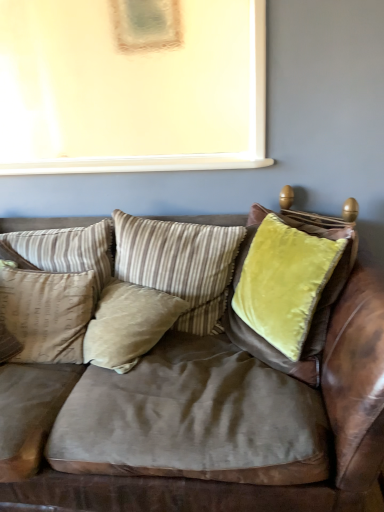
Question: Is beige striped pillow at center, marked as the second pillow in a left-to-right arrangement, taller than beige fabric pillow at left, acting as the 4th pillow starting from the right?

Choices:
 (A) no
 (B) yes

Answer: (A)

Question: Is beige fabric pillow at left, acting as the 4th pillow starting from the right, inside beige striped pillow at center, marked as the second pillow in a left-to-right arrangement?

Choices:
 (A) no
 (B) yes

Answer: (A)

Question: Can you confirm if beige striped pillow at center, marked as the second pillow in a left-to-right arrangement, is shorter than beige fabric pillow at left, arranged as the 1th pillow when viewed from the left?

Choices:
 (A) no
 (B) yes

Answer: (B)

Question: Is beige striped pillow at center, acting as the third pillow starting from the right, bigger than beige fabric pillow at left, arranged as the 1th pillow when viewed from the left?

Choices:
 (A) yes
 (B) no

Answer: (B)

Question: Is beige striped pillow at center, acting as the third pillow starting from the right, touching beige fabric pillow at left, arranged as the 1th pillow when viewed from the left?

Choices:
 (A) no
 (B) yes

Answer: (A)

Question: Considering the relative positions of beige striped pillow at center, marked as the second pillow in a left-to-right arrangement, and beige fabric pillow at left, acting as the 4th pillow starting from the right, in the image provided, is beige striped pillow at center, marked as the second pillow in a left-to-right arrangement, in front of beige fabric pillow at left, acting as the 4th pillow starting from the right,?

Choices:
 (A) no
 (B) yes

Answer: (A)

Question: Is beige velvet pillow at center, placed as the second pillow when sorted from right to left, outside of beige fabric pillow at left, acting as the 4th pillow starting from the right?

Choices:
 (A) no
 (B) yes

Answer: (B)

Question: Considering the relative sizes of beige velvet pillow at center, acting as the 3th pillow starting from the left, and beige fabric pillow at left, acting as the 4th pillow starting from the right, in the image provided, is beige velvet pillow at center, acting as the 3th pillow starting from the left, wider than beige fabric pillow at left, acting as the 4th pillow starting from the right,?

Choices:
 (A) no
 (B) yes

Answer: (B)

Question: Can you confirm if beige velvet pillow at center, placed as the second pillow when sorted from right to left, is shorter than beige fabric pillow at left, acting as the 4th pillow starting from the right?

Choices:
 (A) no
 (B) yes

Answer: (B)

Question: Does beige velvet pillow at center, placed as the second pillow when sorted from right to left, touch beige fabric pillow at left, acting as the 4th pillow starting from the right?

Choices:
 (A) no
 (B) yes

Answer: (A)

Question: Is beige velvet pillow at center, acting as the 3th pillow starting from the left, positioned in front of beige fabric pillow at left, arranged as the 1th pillow when viewed from the left?

Choices:
 (A) yes
 (B) no

Answer: (A)

Question: Is beige velvet pillow at center, placed as the second pillow when sorted from right to left, not close to beige fabric pillow at left, arranged as the 1th pillow when viewed from the left?

Choices:
 (A) yes
 (B) no

Answer: (B)

Question: Is the surface of beige velvet pillow at center, acting as the 3th pillow starting from the left, in direct contact with beige striped pillow at center, marked as the second pillow in a left-to-right arrangement?

Choices:
 (A) yes
 (B) no

Answer: (B)